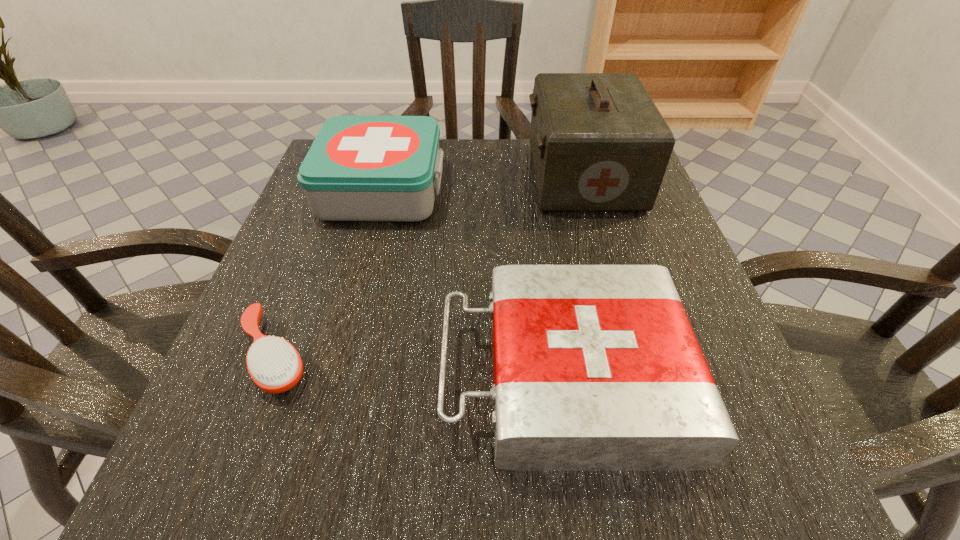
The image size is (960, 540). I want to click on free spot at the right edge of the desktop, so click(597, 213).

In order to click on blank space at the near left corner of the desktop in this screenshot , I will do `click(289, 497)`.

Locate an element on the screen. free point between the shortest object and the tallest object is located at coordinates (429, 265).

Where is `free space between the tallest first-aid kit and the leftmost first-aid kit`? free space between the tallest first-aid kit and the leftmost first-aid kit is located at coordinates (484, 182).

This screenshot has width=960, height=540. What are the coordinates of `vacant area that lies between the third tallest object and the hairbrush` in the screenshot? It's located at (420, 365).

Where is `blank region between the tallest first-aid kit and the shortest object`? This screenshot has width=960, height=540. blank region between the tallest first-aid kit and the shortest object is located at coordinates (429, 265).

You are a GUI agent. You are given a task and a screenshot of the screen. Output one action in this format:
    pyautogui.click(x=<x>, y=<y>)
    Task: Click on the free spot between the hairbrush and the leftmost first-aid kit
    
    Given the screenshot: What is the action you would take?
    pyautogui.click(x=329, y=272)

Find the location of a particular element. Image resolution: width=960 pixels, height=540 pixels. vacant point located between the tallest object and the leftmost first-aid kit is located at coordinates (484, 182).

The image size is (960, 540). I want to click on vacant area that lies between the nearest first-aid kit and the leftmost first-aid kit, so click(x=473, y=282).

The image size is (960, 540). Identify the location of vacant region between the third tallest object and the leftmost first-aid kit. (473, 282).